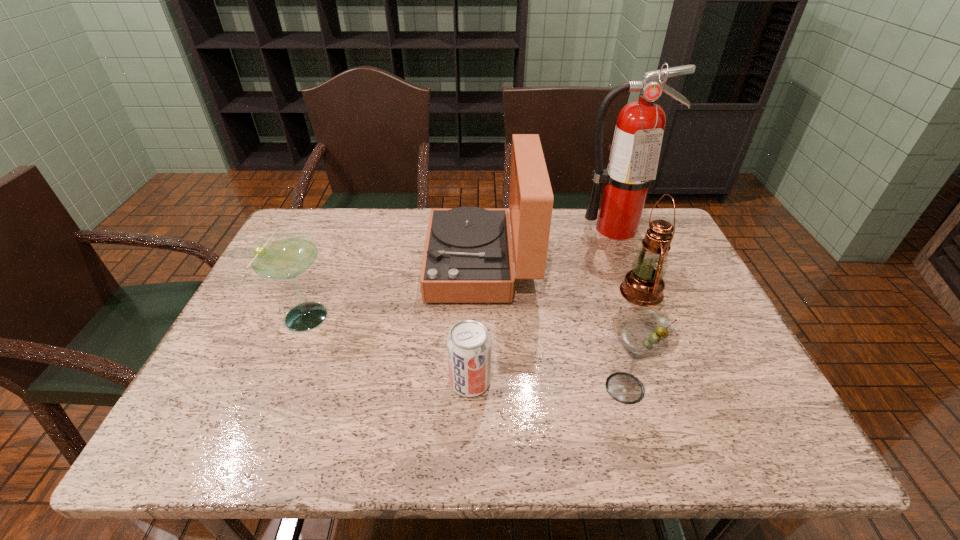
In order to click on free space that satisfies the following two spatial constraints: 1. on the back side of the oil lamp; 2. on the right side of the shortest object in this screenshot , I will do `click(471, 292)`.

You are a GUI agent. You are given a task and a screenshot of the screen. Output one action in this format:
    pyautogui.click(x=<x>, y=<y>)
    Task: Click on the vacant position in the image that satisfies the following two spatial constraints: 1. on the back side of the nearer martini; 2. on the face of the phonograph record
    This screenshot has width=960, height=540.
    Given the screenshot: What is the action you would take?
    pyautogui.click(x=589, y=265)

You are a GUI agent. You are given a task and a screenshot of the screen. Output one action in this format:
    pyautogui.click(x=<x>, y=<y>)
    Task: Click on the free spot that satisfies the following two spatial constraints: 1. on the front side of the soda can; 2. on the right side of the nearer martini
    The width and height of the screenshot is (960, 540).
    Given the screenshot: What is the action you would take?
    pyautogui.click(x=469, y=388)